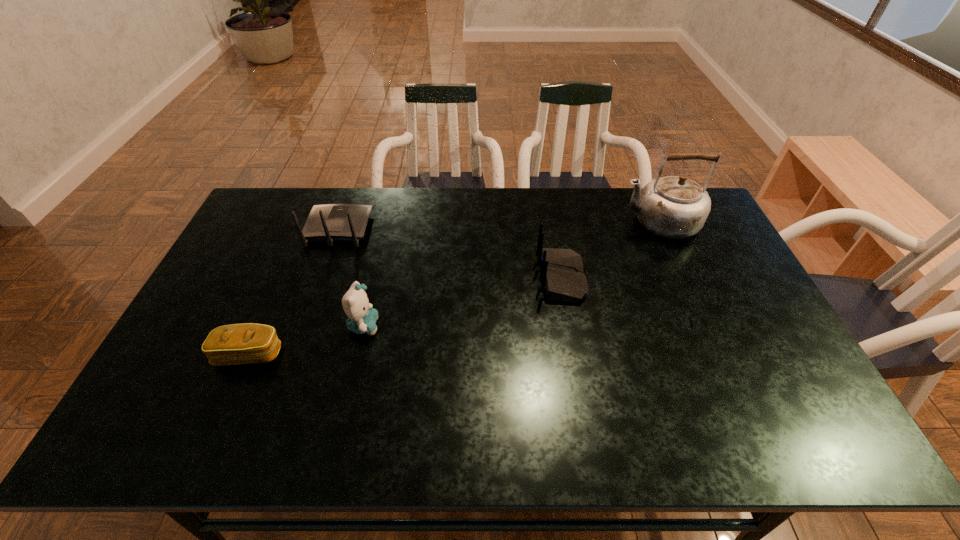
Locate an element on the screen. The image size is (960, 540). vacant space located 0.130m on the front-facing side of the left router is located at coordinates (352, 190).

This screenshot has width=960, height=540. Identify the location of vacant position located 0.110m on the front-facing side of the left router. (350, 193).

Identify the location of free space located on the back of the nearer router. The height and width of the screenshot is (540, 960). (479, 278).

The width and height of the screenshot is (960, 540). I want to click on vacant position located 0.150m on the back of the nearer router, so click(x=489, y=278).

Identify the location of vacant space located on the back of the nearer router. Image resolution: width=960 pixels, height=540 pixels. (495, 278).

You are a GUI agent. You are given a task and a screenshot of the screen. Output one action in this format:
    pyautogui.click(x=<x>, y=<y>)
    Task: Click on the free point located 0.400m on the face of the kitten
    Image resolution: width=960 pixels, height=540 pixels.
    Given the screenshot: What is the action you would take?
    pyautogui.click(x=523, y=326)

Image resolution: width=960 pixels, height=540 pixels. I want to click on vacant region located on the zipper side of the clutch bag, so click(x=213, y=439).

You are a GUI agent. You are given a task and a screenshot of the screen. Output one action in this format:
    pyautogui.click(x=<x>, y=<y>)
    Task: Click on the kettle positioned at the far edge
    The image size is (960, 540).
    Given the screenshot: What is the action you would take?
    pyautogui.click(x=675, y=207)

In order to click on router that is at the far edge in this screenshot , I will do `click(331, 222)`.

The height and width of the screenshot is (540, 960). Find the location of `object located in the left edge section of the desktop`. object located in the left edge section of the desktop is located at coordinates (245, 343).